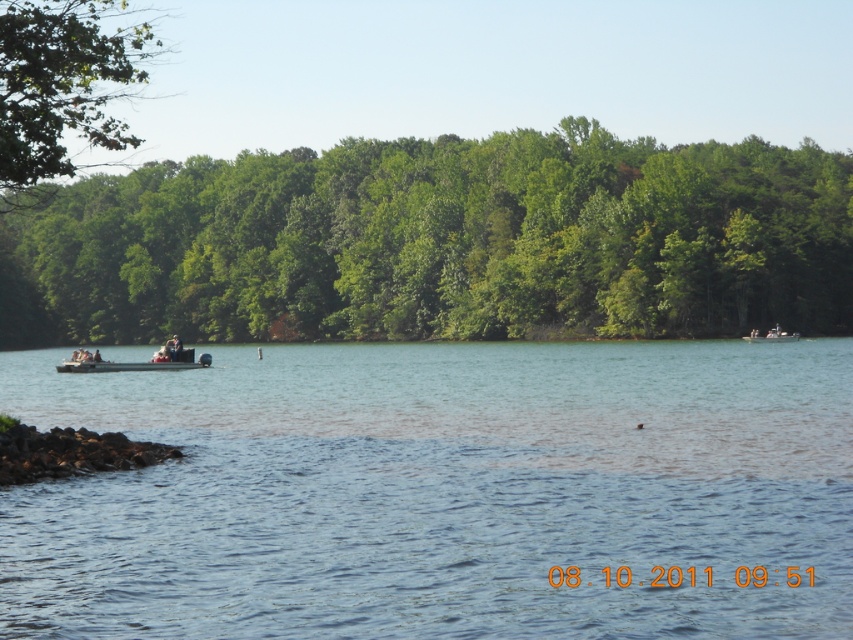
In the scene shown: You are a photographer planning to capture the clear blue water at center and the metallic gray pontoon boat at left in a single shot. Based on their heights, which object will appear larger in the photograph?

The clear blue water at center will appear larger in the photograph because it has a greater height compared to the metallic gray pontoon boat at left.

You are standing on the lakeside and want to take a photo of the metallic gray pontoon boat at left and the clear blue water at center. Which object should you focus on first if you want to capture both in the same frame without moving your camera? Explain your reasoning based on their positions.

The metallic gray pontoon boat at left is on the left side of the clear blue water at center. Since they are positioned side by side horizontally, you can focus on either one first as long as your camera frame includes both. However, to ensure both are in focus, you might want to focus on the metallic gray pontoon boat at left first since it is closer to the left edge, allowing you to adjust the frame to include the clear blue water at center on the right.